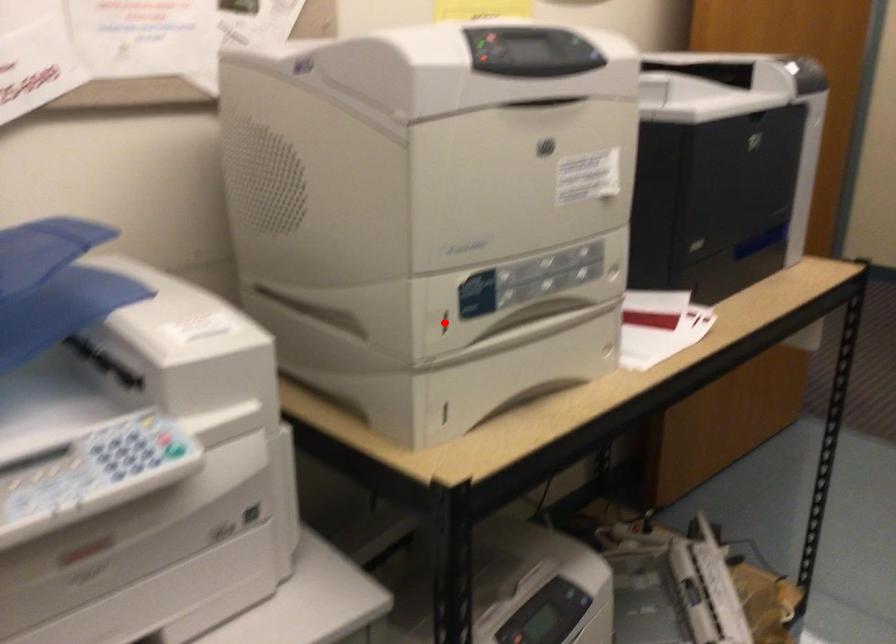
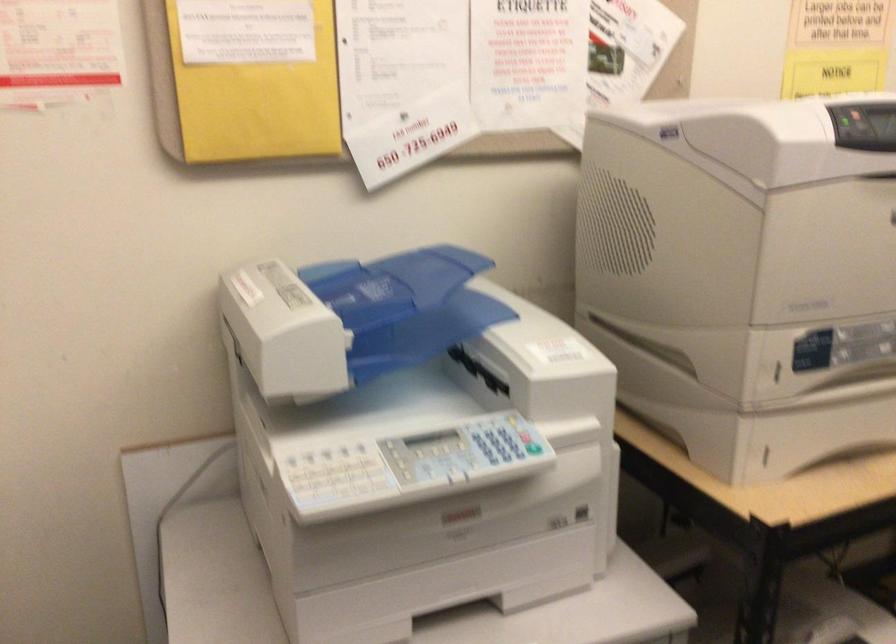
In the second image, find the point that corresponds to the highlighted location in the first image.

(777, 372)